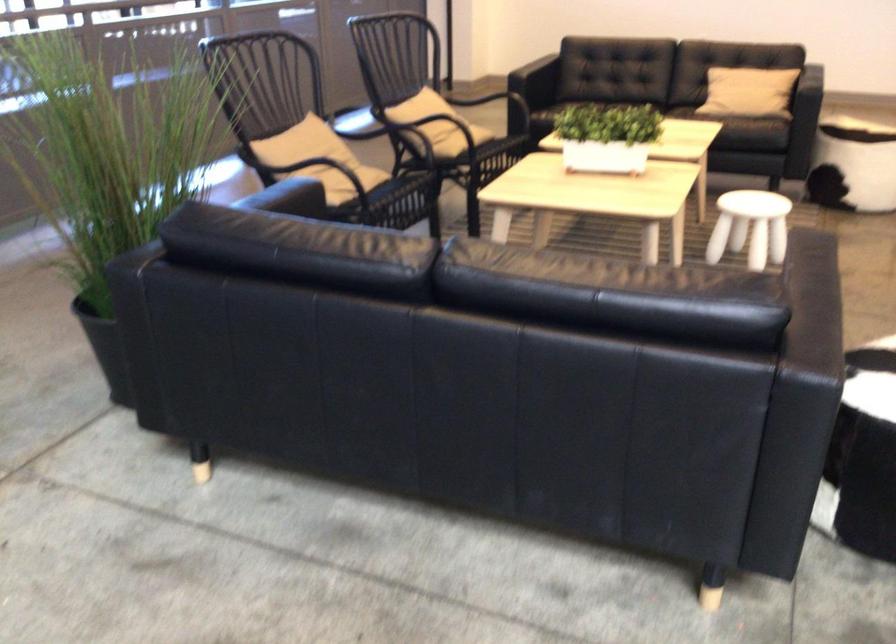
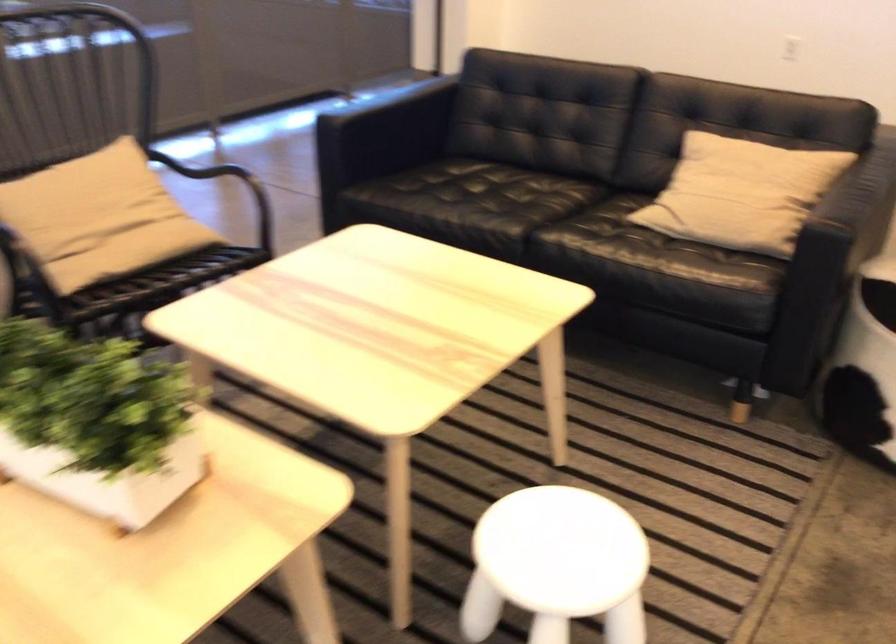
Question: I am providing you with two images of the same scene from different viewpoints. Which of the following objects are not visible in image2?

Choices:
 (A) cabinet drawer key
 (B) sofa sitting surface
 (C) patterned cylindrical ottoman
 (D) beige pillow

Answer: (C)